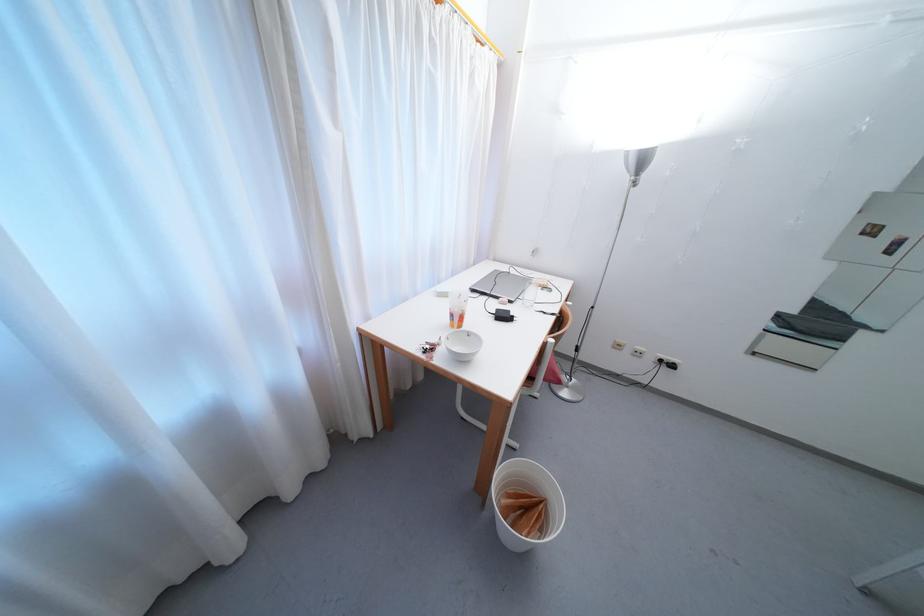
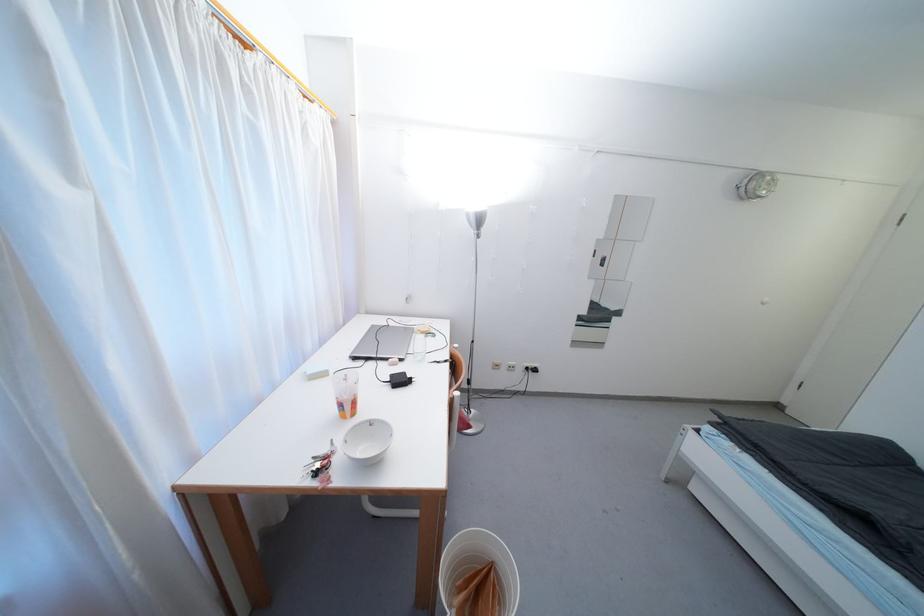
Question: The camera is either moving clockwise (left) or counter-clockwise (right) around the object. The first image is from the beginning of the video and the second image is from the end. Is the camera moving left or right when shooting the video?

Choices:
 (A) Left
 (B) Right

Answer: (A)